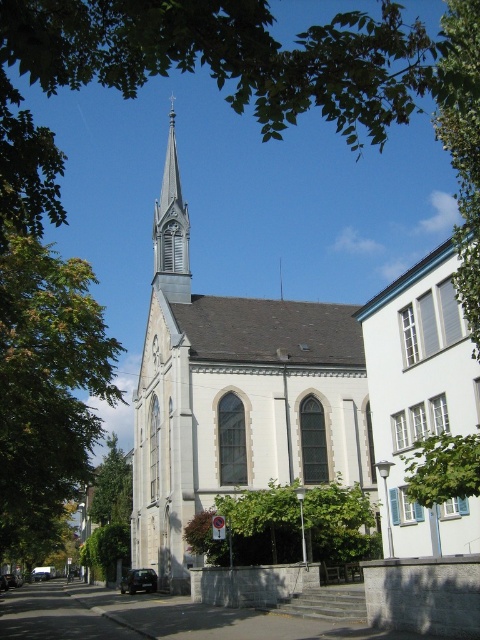
Who is lower down, green leafy tree at center or green leafy tree at upper center?

green leafy tree at center is below.

Is green leafy tree at center positioned before green leafy tree at upper center?

That is False.

Is point (333, 557) in front of point (472, 120)?

That is False.

The width and height of the screenshot is (480, 640). I want to click on green leafy tree at center, so pyautogui.click(x=251, y=528).

Does white stone chapel at center come behind gray stone spire at center?

That is False.

Is point (330, 316) in front of point (170, 275)?

No, (330, 316) is behind (170, 275).

This screenshot has width=480, height=640. What are the coordinates of `white stone chapel at center` in the screenshot? It's located at (235, 396).

Is green leafy tree at lower left to the right of gray stone spire at center from the viewer's perspective?

Incorrect, green leafy tree at lower left is not on the right side of gray stone spire at center.

Which is behind, point (92, 492) or point (172, 241)?

The point (92, 492) is behind.

Describe the element at coordinates (108, 513) in the screenshot. I see `green leafy tree at lower left` at that location.

Identify the location of green leafy tree at lower left. (108, 513).